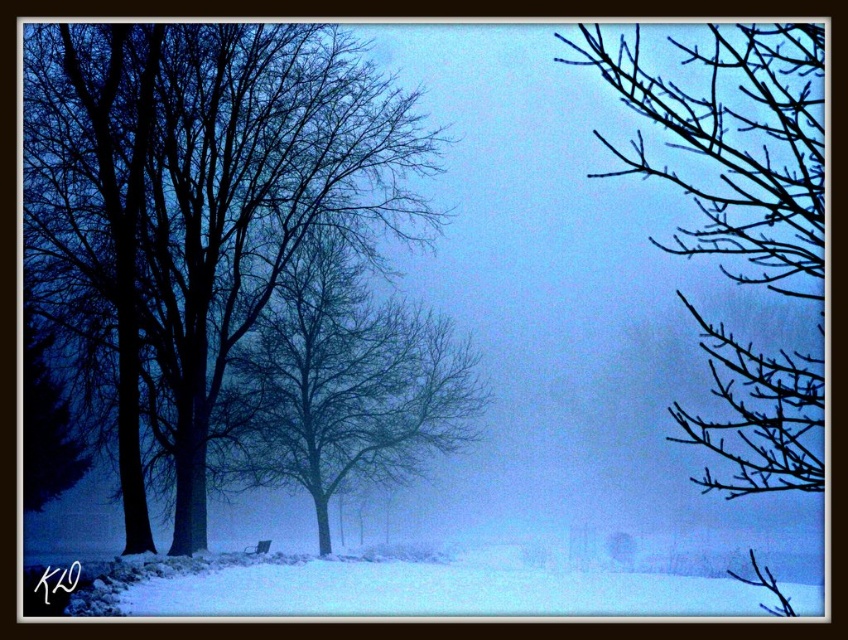
Consider the image. How far apart are black matte tree at left and bare branches at center?

black matte tree at left is 3.18 meters away from bare branches at center.

Does black matte tree at left appear over bare branches at center?

Yes.

Is point (118, 196) behind point (434, 420)?

That is False.

Find the location of a particular element. The height and width of the screenshot is (640, 848). black matte tree at left is located at coordinates (x=194, y=212).

Is black bare branches at upper right to the left of bare branches at center from the viewer's perspective?

Incorrect, black bare branches at upper right is not on the left side of bare branches at center.

Which is behind, point (796, 77) or point (237, 355)?

Positioned behind is point (237, 355).

Where is `black bare branches at upper right`? Image resolution: width=848 pixels, height=640 pixels. black bare branches at upper right is located at coordinates (735, 145).

Who is taller, black matte tree at left or black bare branches at upper right?

black bare branches at upper right

Is black matte tree at left positioned behind black bare branches at upper right?

Yes, black matte tree at left is behind black bare branches at upper right.

At what (x,y) coordinates should I click in order to perform the action: click on black matte tree at left. Please return your answer as a coordinate pair (x, y). Looking at the image, I should click on click(x=194, y=212).